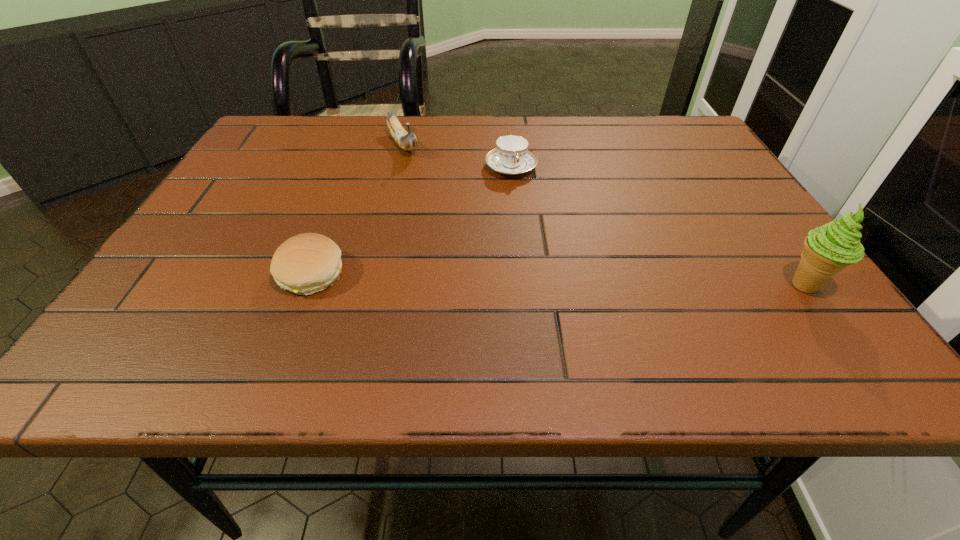
Where is `free area in between the third object from left to right and the leftmost object`? This screenshot has height=540, width=960. free area in between the third object from left to right and the leftmost object is located at coordinates (411, 220).

Where is `vacant area that lies between the second object from right to left and the tallest object`? This screenshot has width=960, height=540. vacant area that lies between the second object from right to left and the tallest object is located at coordinates (658, 226).

I want to click on free space that is in between the leftmost object and the second object from left to right, so click(357, 210).

At what (x,y) coordinates should I click in order to perform the action: click on free area in between the icecream and the second tallest object. Please return your answer as a coordinate pair (x, y). This screenshot has height=540, width=960. Looking at the image, I should click on (604, 215).

Locate an element on the screen. free point between the teacup and the leftmost object is located at coordinates (411, 220).

Where is `unoccupied area between the patty and the teacup`? This screenshot has width=960, height=540. unoccupied area between the patty and the teacup is located at coordinates (411, 220).

Find the location of `the closest object to the third object from right to left`. the closest object to the third object from right to left is located at coordinates (511, 156).

Locate which object is the second closest to the second object from right to left. Please provide its 2D coordinates. Your answer should be formatted as a tuple, i.e. [(x, y)], where the tuple contains the x and y coordinates of a point satisfying the conditions above.

[(304, 264)]

This screenshot has width=960, height=540. In order to click on free point that satisfies the following two spatial constraints: 1. on the front side of the third shortest object; 2. on the left side of the icecream in this screenshot , I will do `click(369, 286)`.